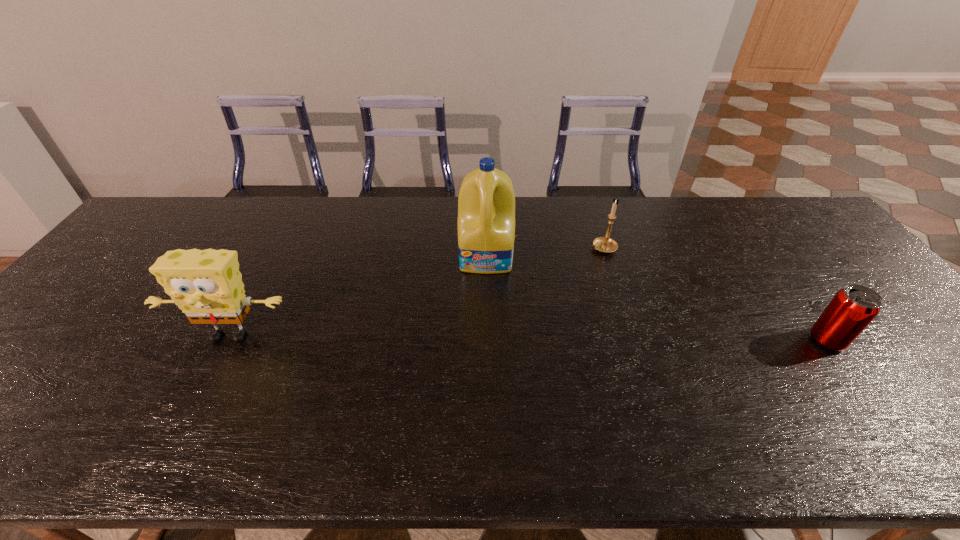
Locate an element on the screen. Image resolution: width=960 pixels, height=540 pixels. the third closest object to the second object from left to right is located at coordinates (852, 309).

Locate an element on the screen. Image resolution: width=960 pixels, height=540 pixels. free space in the image that satisfies the following two spatial constraints: 1. on the face of the soda can; 2. on the left side of the sponge is located at coordinates (228, 340).